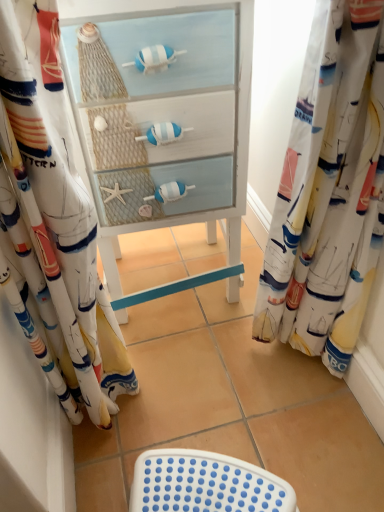
Locate an element on the screen. The height and width of the screenshot is (512, 384). empty space that is ontop of white plastic stool at lower center (from a real-world perspective) is located at coordinates (206, 485).